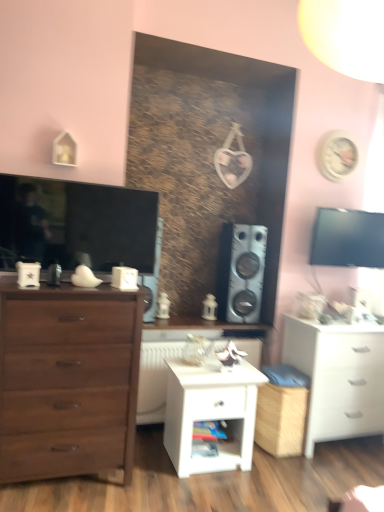
Locate an element on the screen. free space on the front side of white glossy nightstand at center is located at coordinates (197, 489).